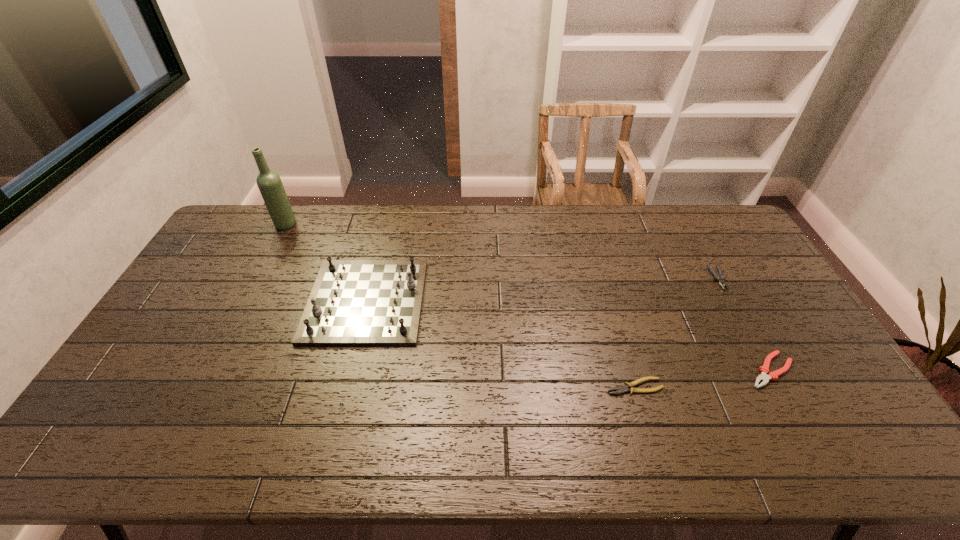
What are the coordinates of `the tallest object` in the screenshot? It's located at (269, 183).

Where is `the farthest object`? The height and width of the screenshot is (540, 960). the farthest object is located at coordinates (269, 183).

I want to click on the fourth shortest object, so click(353, 302).

The image size is (960, 540). What are the coordinates of `the fourth object from right to left` in the screenshot? It's located at (353, 302).

At what (x,y) coordinates should I click in order to perform the action: click on the farthest pliers. Please return your answer as a coordinate pair (x, y). Looking at the image, I should click on (720, 279).

You are a GUI agent. You are given a task and a screenshot of the screen. Output one action in this format:
    pyautogui.click(x=<x>, y=<y>)
    Task: Click on the leftmost pliers
    Image resolution: width=960 pixels, height=540 pixels.
    Given the screenshot: What is the action you would take?
    pyautogui.click(x=620, y=389)

You are a GUI agent. You are given a task and a screenshot of the screen. Output one action in this format:
    pyautogui.click(x=<x>, y=<y>)
    Task: Click on the shortest pliers
    This screenshot has height=540, width=960.
    Given the screenshot: What is the action you would take?
    pyautogui.click(x=620, y=389)

Locate an element on the screen. The height and width of the screenshot is (540, 960). vacant area situated 0.380m on the right of the farthest object is located at coordinates (396, 225).

At what (x,y) coordinates should I click in order to perform the action: click on free region located 0.050m on the board of the fourth shortest object. Please return your answer as a coordinate pair (x, y). This screenshot has width=960, height=540. Looking at the image, I should click on (438, 301).

The height and width of the screenshot is (540, 960). Identify the location of vacant region located at the gripping part of the farthest pliers. (732, 303).